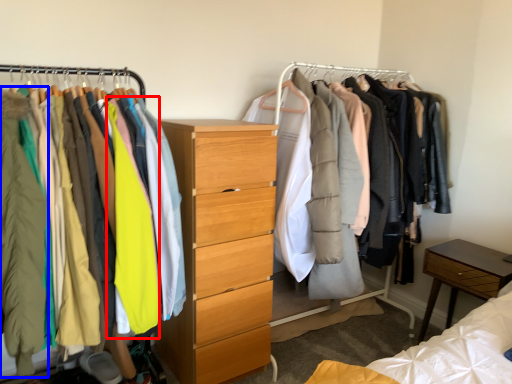
Question: Which object is closer to the camera taking this photo, clothing (highlighted by a red box) or clothing (highlighted by a blue box)?

Choices:
 (A) clothing
 (B) clothing

Answer: (B)